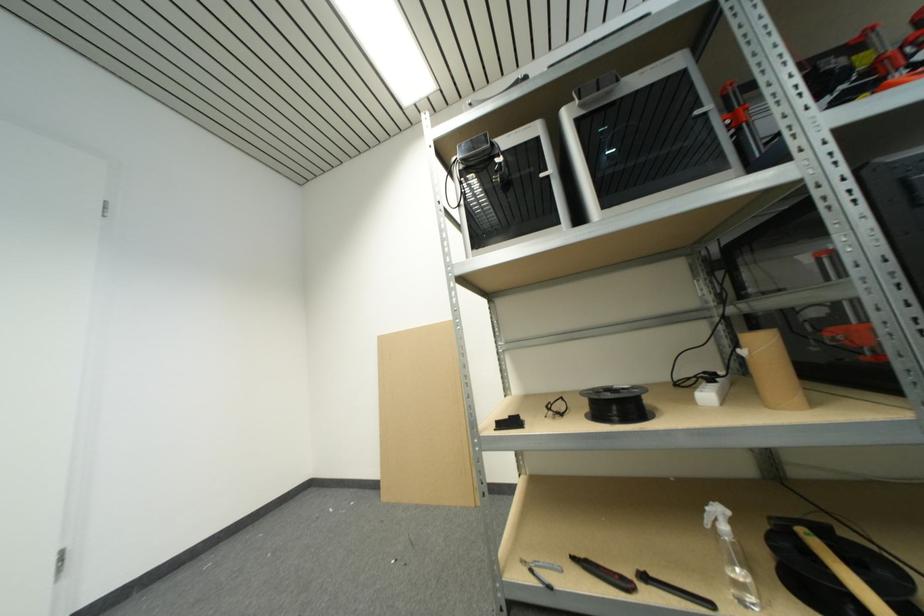
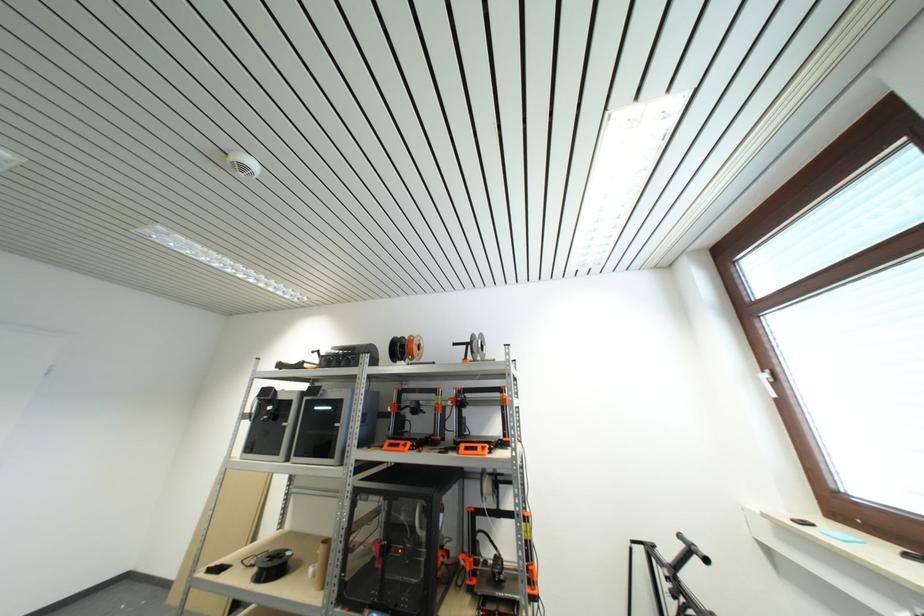
Find the pixel in the second image that matches point (700, 116) in the first image.

(341, 427)